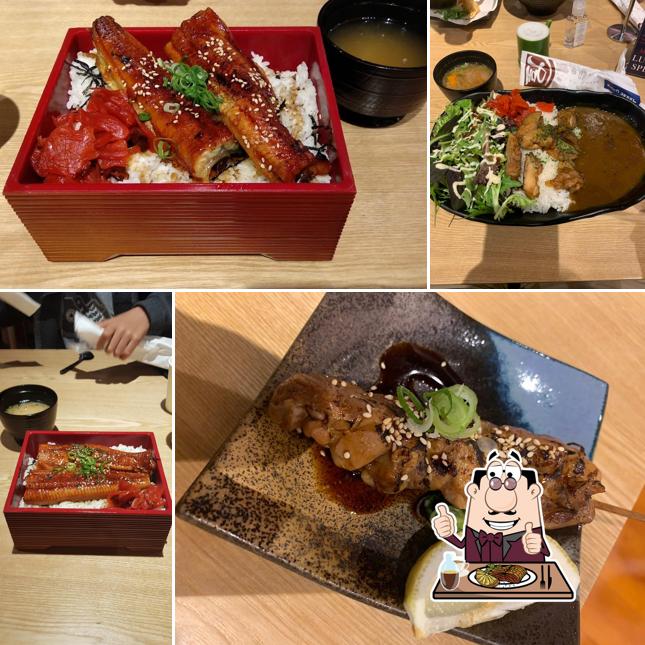
Where is `red dish`? This screenshot has height=645, width=645. red dish is located at coordinates (184, 241).